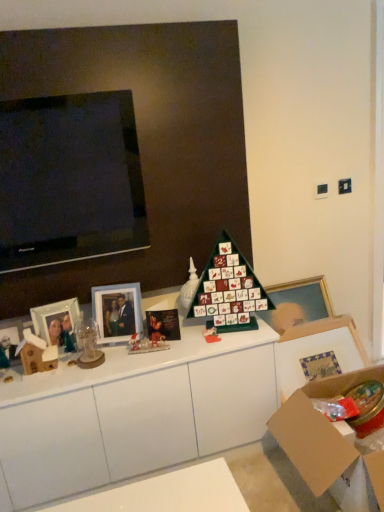
The width and height of the screenshot is (384, 512). Identify the location of free space in front of matte glass photo frame at left, the third picture frame when ordered from right to left. (56, 381).